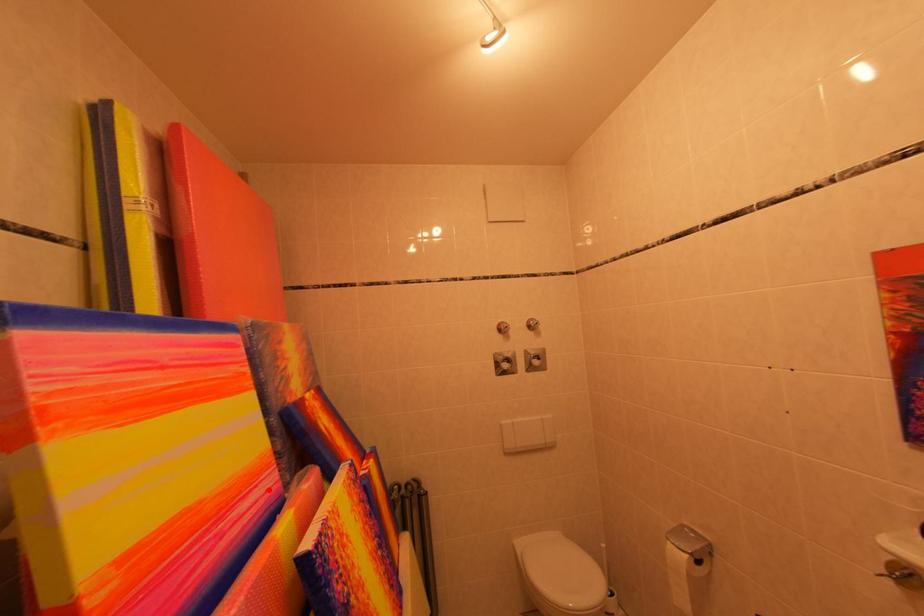
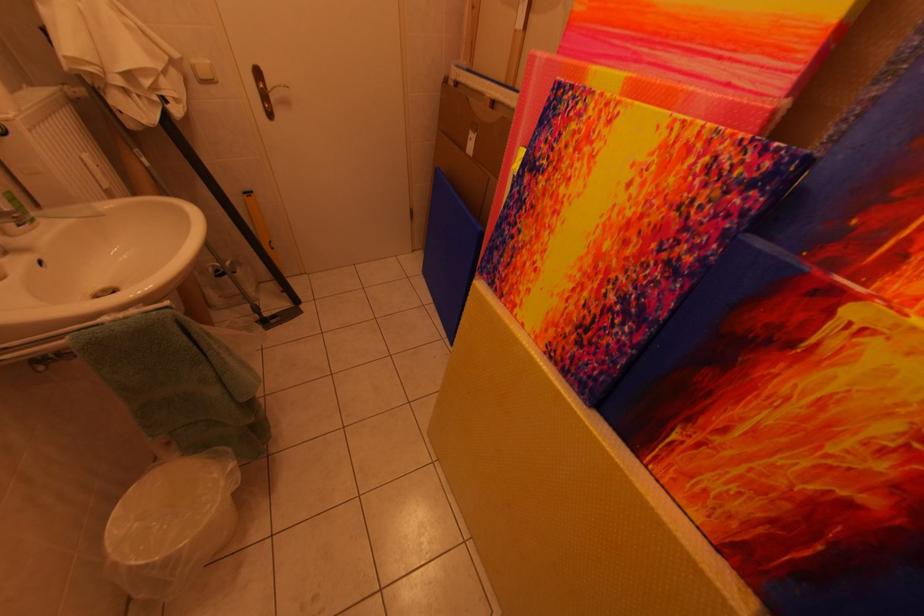
The point at the highlighted location is marked in the first image. Where is the corresponding point in the second image?

(734, 68)